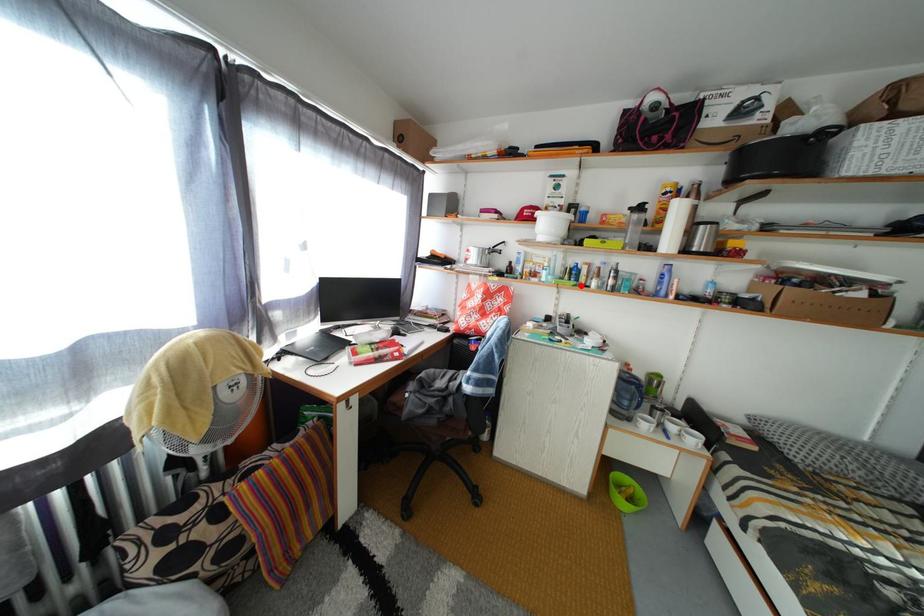
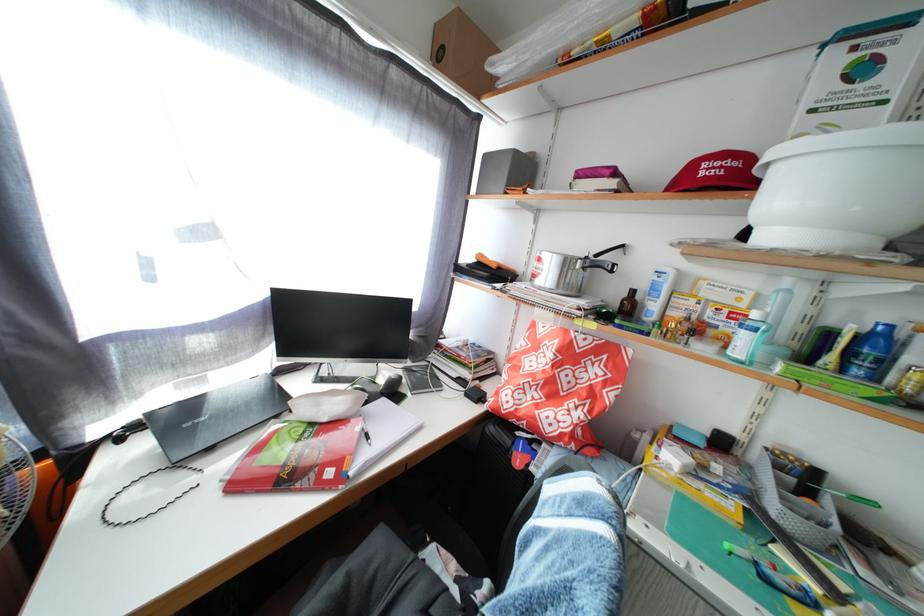
Question: I am providing you with two images of the same scene from different viewpoints. A red point is marked on the first image. Is the red point's position out of view in image 2?

Choices:
 (A) Yes
 (B) No

Answer: (B)